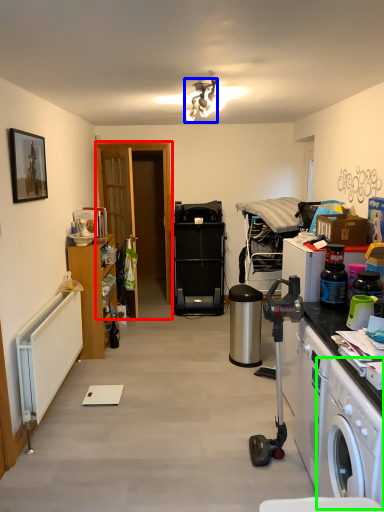
Question: Based on their relative distances, which object is farther from door (highlighted by a red box)? Choose from lamp (highlighted by a blue box) and washing machine (highlighted by a green box).

Choices:
 (A) lamp
 (B) washing machine

Answer: (B)